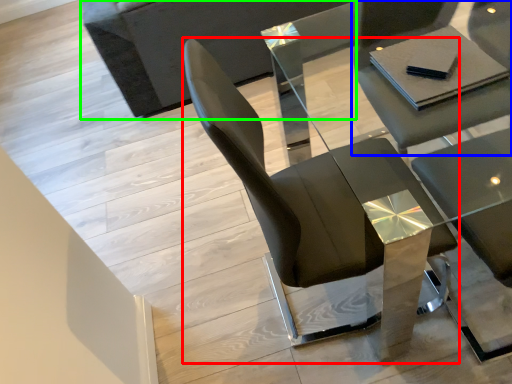
Question: Considering the real-world distances, which object is closest to chair (highlighted by a red box)? chair (highlighted by a blue box) or couch (highlighted by a green box).

Choices:
 (A) chair
 (B) couch

Answer: (A)